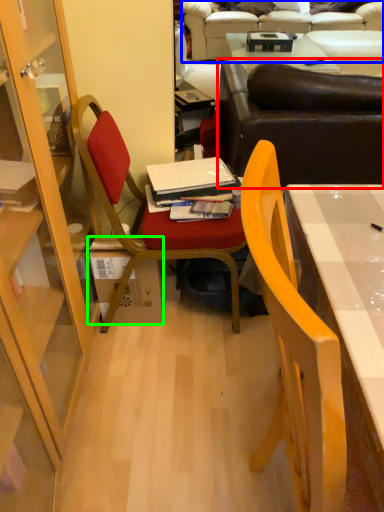
Question: Which object is positioned closest to studio couch (highlighted by a red box)? Select from studio couch (highlighted by a blue box) and box (highlighted by a green box).

Choices:
 (A) studio couch
 (B) box

Answer: (B)